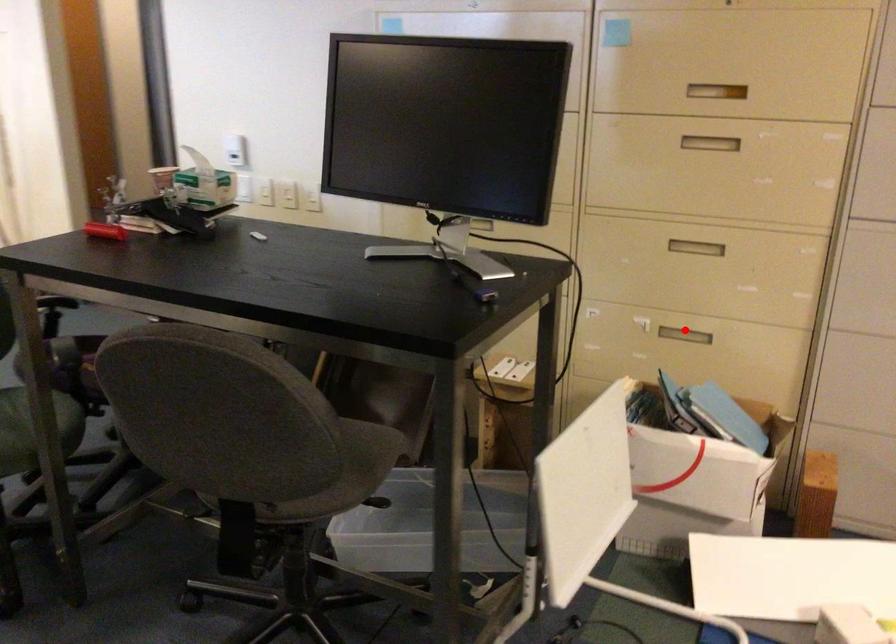
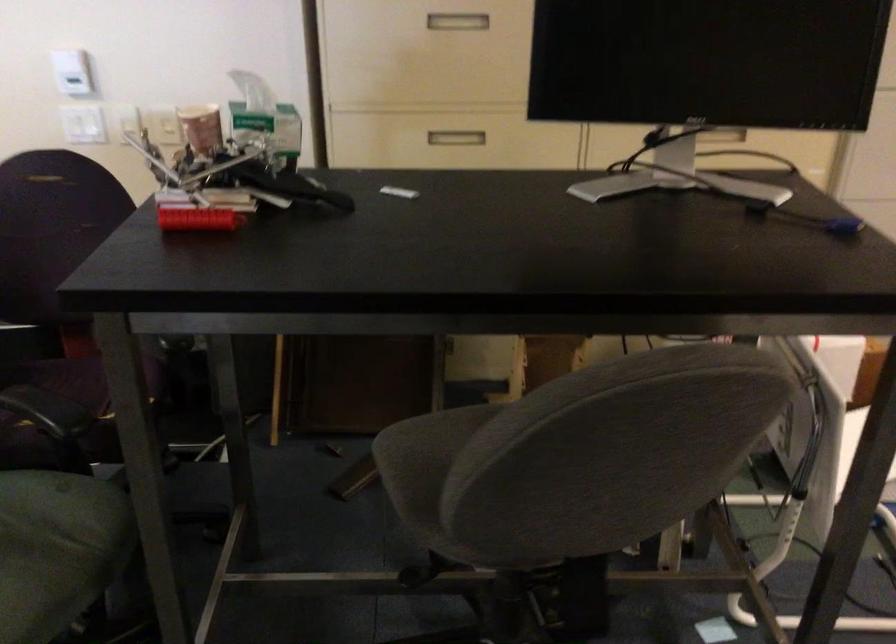
Question: I am providing you with two images of the same scene from different viewpoints. A red point is marked on the first image. Is the red point's position out of view in image 2?

Choices:
 (A) Yes
 (B) No

Answer: (A)